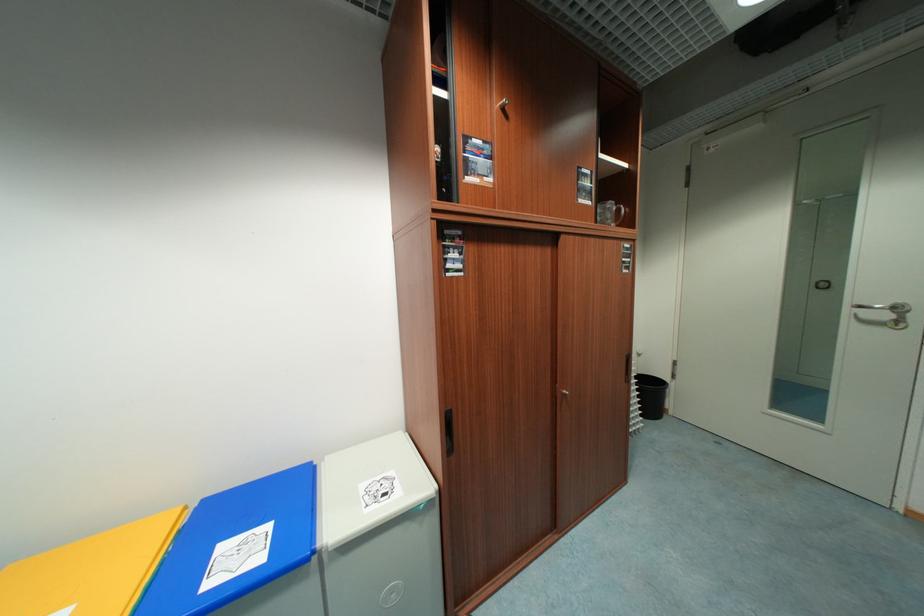
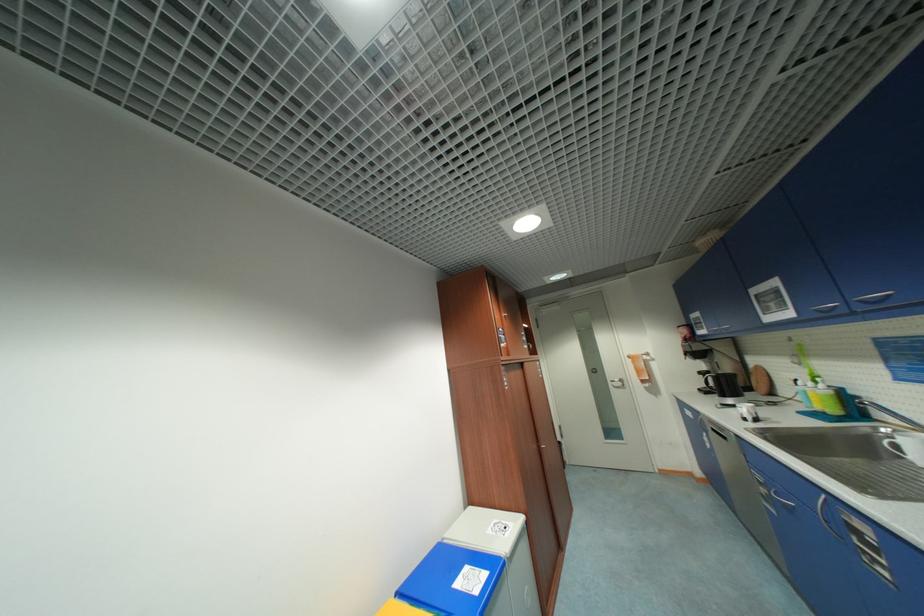
The point at (369, 488) is marked in the first image. Where is the corresponding point in the second image?

(495, 533)